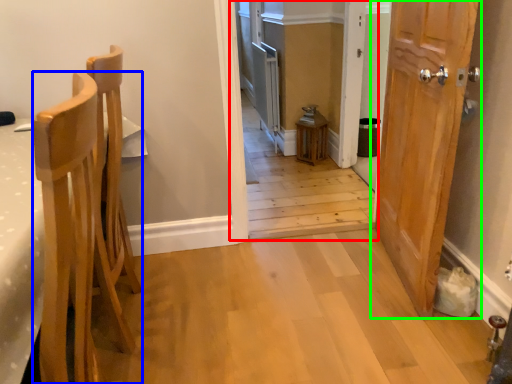
Question: Based on their relative distances, which object is nearer to corridor (highlighted by a red box)? Choose from chair (highlighted by a blue box) and door (highlighted by a green box).

Choices:
 (A) chair
 (B) door

Answer: (B)